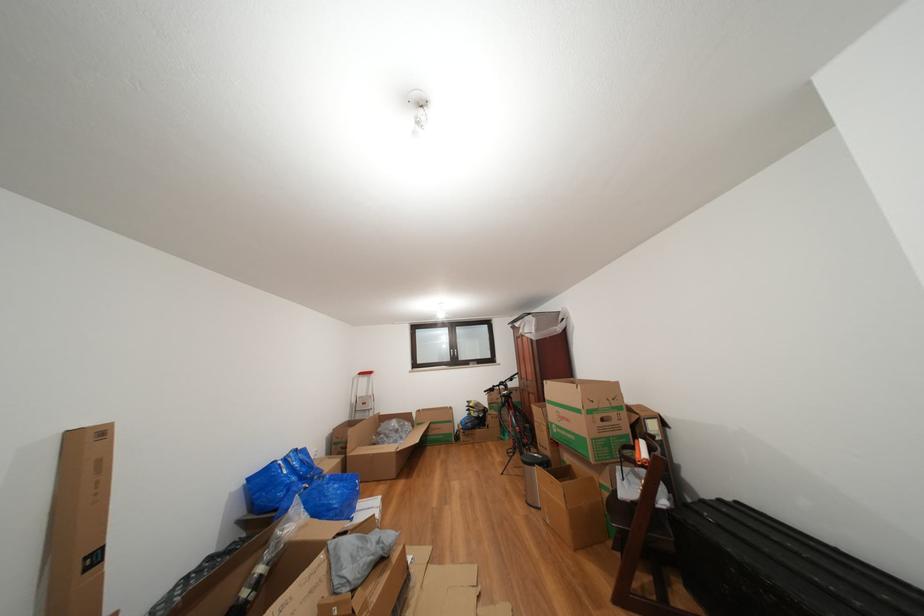
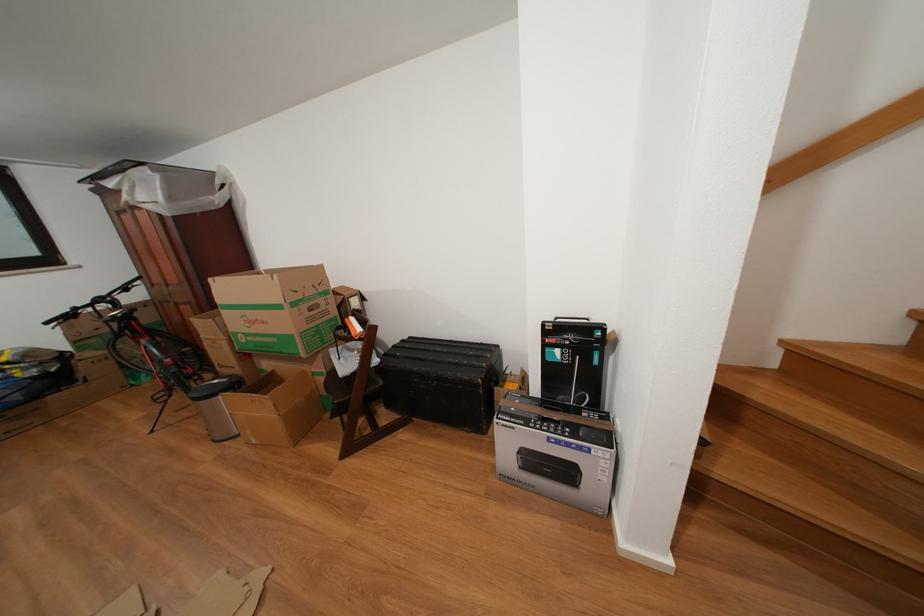
The point at [512,403] is marked in the first image. Where is the corresponding point in the second image?

(123, 330)